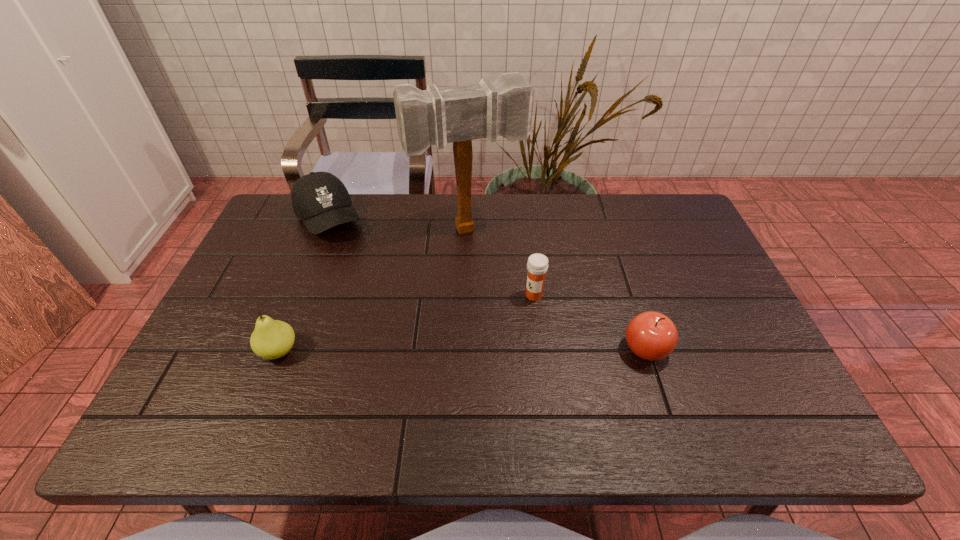
Where is `blank area located on the front-facing side of the baseball cap`? The width and height of the screenshot is (960, 540). blank area located on the front-facing side of the baseball cap is located at coordinates (349, 258).

Where is `free space located 0.300m on the front-facing side of the baseball cap`? free space located 0.300m on the front-facing side of the baseball cap is located at coordinates (379, 306).

Identify the location of free spot located on the front-facing side of the baseball cap. The height and width of the screenshot is (540, 960). (379, 306).

At what (x,y) coordinates should I click in order to perform the action: click on vacant position located 0.120m on the label side of the third farthest object. Please return your answer as a coordinate pair (x, y). Looking at the image, I should click on (492, 323).

This screenshot has width=960, height=540. I want to click on free region located 0.100m on the label side of the third farthest object, so click(498, 319).

In order to click on blank space located 0.360m on the label side of the third farthest object in this screenshot , I will do `click(413, 377)`.

At what (x,y) coordinates should I click in order to perform the action: click on mallet located in the far edge section of the desktop. Please return your answer as a coordinate pair (x, y). Looking at the image, I should click on (461, 114).

You are a GUI agent. You are given a task and a screenshot of the screen. Output one action in this format:
    pyautogui.click(x=<x>, y=<y>)
    Task: Click on the baseball cap that is at the far edge
    Image resolution: width=960 pixels, height=540 pixels.
    Given the screenshot: What is the action you would take?
    pyautogui.click(x=320, y=199)

Locate an element on the screen. The image size is (960, 540). pear that is at the near edge is located at coordinates (271, 339).

Image resolution: width=960 pixels, height=540 pixels. What are the coordinates of `apple that is positioned at the near edge` in the screenshot? It's located at (652, 336).